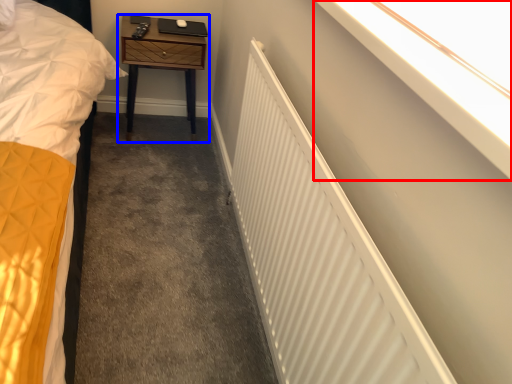
Question: Which object is further to the camera taking this photo, window sill (highlighted by a red box) or nightstand (highlighted by a blue box)?

Choices:
 (A) window sill
 (B) nightstand

Answer: (B)